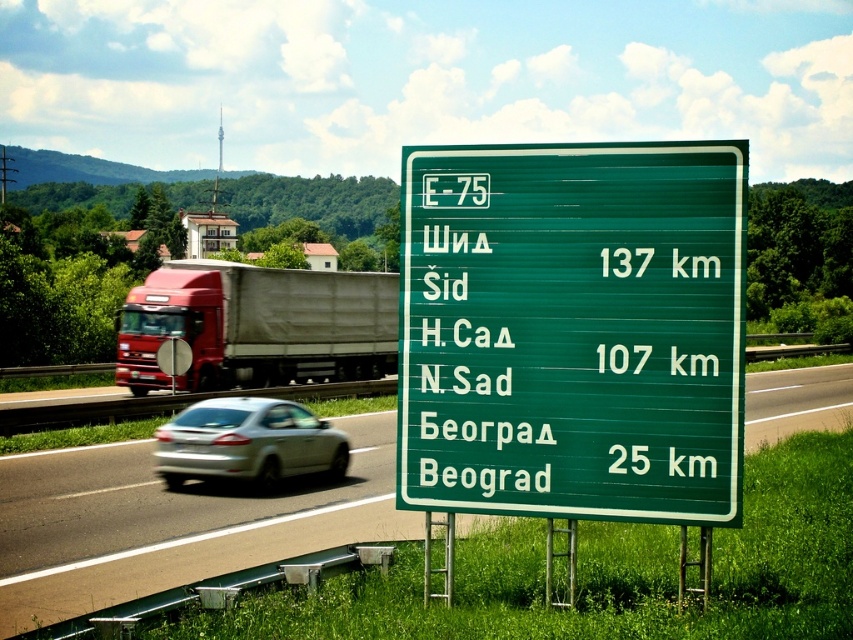
You are a driver approaching the green plastic sign at center and the silver metallic sedan at center on the highway. Which object will appear closer to you as you look ahead?

The silver metallic sedan at center will appear closer because it is larger in size compared to the green plastic sign at center, indicating it is nearer to your position.

You are a driver approaching the green plastic sign at center and the green signpost at center on the highway. Which object will you see first as you drive towards them?

The green plastic sign at center is taller than the green signpost at center, so you will see the green plastic sign at center first because taller objects become visible before shorter ones when approaching from a distance.

You are a driver approaching the green plastic sign at center and the silver metallic sedan at center on the highway. Which object is positioned higher relative to the road surface?

The green plastic sign at center is located above the silver metallic sedan at center, so it is positioned higher relative to the road surface.